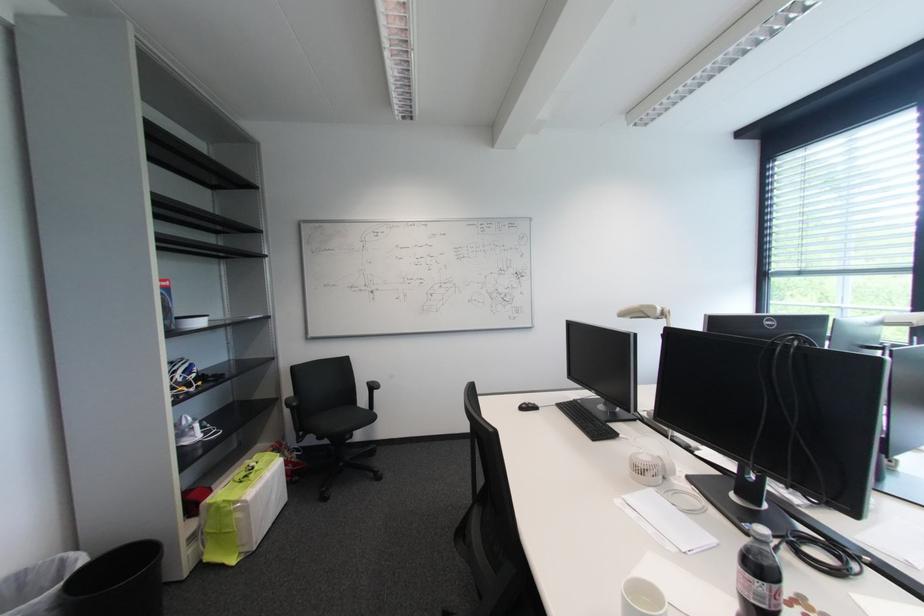
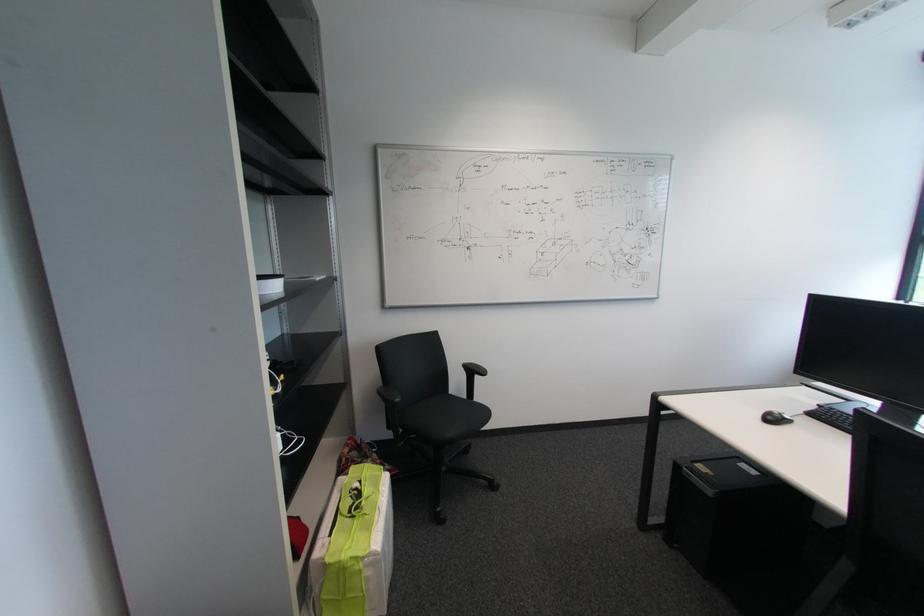
The point at (244,521) is marked in the first image. Where is the corresponding point in the second image?

(372, 581)